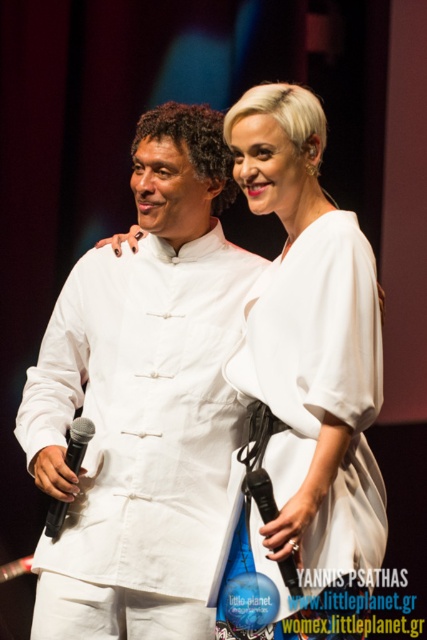
Question: Which is nearer to the black matte microphone at left?

Choices:
 (A) black plastic microphone at center
 (B) white matte dress at center
 (C) white matte shirt at center
 (D) white satin dress at center

Answer: (C)

Question: In this image, where is white satin dress at center located relative to black matte microphone at left?

Choices:
 (A) left
 (B) right

Answer: (B)

Question: Considering the relative positions of black matte microphone at left and black plastic microphone at center in the image provided, where is black matte microphone at left located with respect to black plastic microphone at center?

Choices:
 (A) left
 (B) right

Answer: (A)

Question: Which point is closer to the camera?

Choices:
 (A) white matte shirt at center
 (B) black matte microphone at left
 (C) black plastic microphone at center
 (D) white satin dress at center

Answer: (C)

Question: Which of the following is the farthest from the observer?

Choices:
 (A) (251, 456)
 (B) (263, 477)
 (C) (265, 348)
 (D) (196, 588)

Answer: (D)

Question: Is white matte shirt at center positioned at the back of white satin dress at center?

Choices:
 (A) no
 (B) yes

Answer: (B)